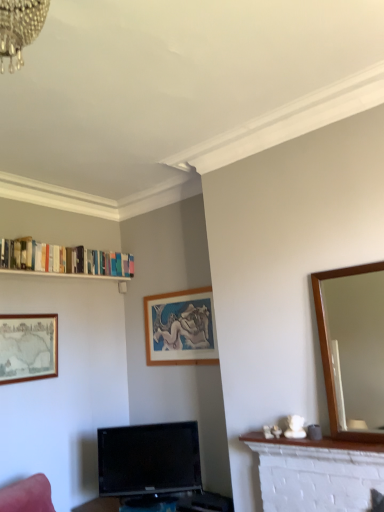
Question: Is white brick fireplace at lower right closer to camera compared to wooden picture frame at center, which is counted as the second picture frame, starting from the left?

Choices:
 (A) no
 (B) yes

Answer: (B)

Question: Could you tell me if white brick fireplace at lower right is turned towards wooden picture frame at center, which is counted as the second picture frame, starting from the left?

Choices:
 (A) no
 (B) yes

Answer: (A)

Question: Is white brick fireplace at lower right to the right of wooden picture frame at center, marked as the 1th picture frame in a right-to-left arrangement, from the viewer's perspective?

Choices:
 (A) no
 (B) yes

Answer: (B)

Question: From a real-world perspective, is white brick fireplace at lower right under wooden picture frame at center, which is counted as the second picture frame, starting from the left?

Choices:
 (A) no
 (B) yes

Answer: (B)

Question: Considering the relative sizes of white brick fireplace at lower right and wooden picture frame at center, which is counted as the second picture frame, starting from the left, in the image provided, is white brick fireplace at lower right bigger than wooden picture frame at center, which is counted as the second picture frame, starting from the left,?

Choices:
 (A) yes
 (B) no

Answer: (B)

Question: From a real-world perspective, is white brick fireplace at lower right physically above wooden picture frame at center, marked as the 1th picture frame in a right-to-left arrangement?

Choices:
 (A) yes
 (B) no

Answer: (B)

Question: From the image's perspective, is white brick fireplace at lower right under wooden mirror at right?

Choices:
 (A) no
 (B) yes

Answer: (B)

Question: Is white brick fireplace at lower right looking in the opposite direction of wooden mirror at right?

Choices:
 (A) no
 (B) yes

Answer: (A)

Question: Considering the relative sizes of white brick fireplace at lower right and wooden mirror at right in the image provided, is white brick fireplace at lower right wider than wooden mirror at right?

Choices:
 (A) yes
 (B) no

Answer: (A)

Question: From a real-world perspective, is white brick fireplace at lower right located beneath wooden mirror at right?

Choices:
 (A) yes
 (B) no

Answer: (A)

Question: Does white brick fireplace at lower right have a greater height compared to wooden mirror at right?

Choices:
 (A) no
 (B) yes

Answer: (A)

Question: Is white brick fireplace at lower right closer to the viewer compared to wooden mirror at right?

Choices:
 (A) no
 (B) yes

Answer: (A)

Question: Can you see black glossy tv at lower center touching white glossy bookshelf at upper left?

Choices:
 (A) yes
 (B) no

Answer: (B)